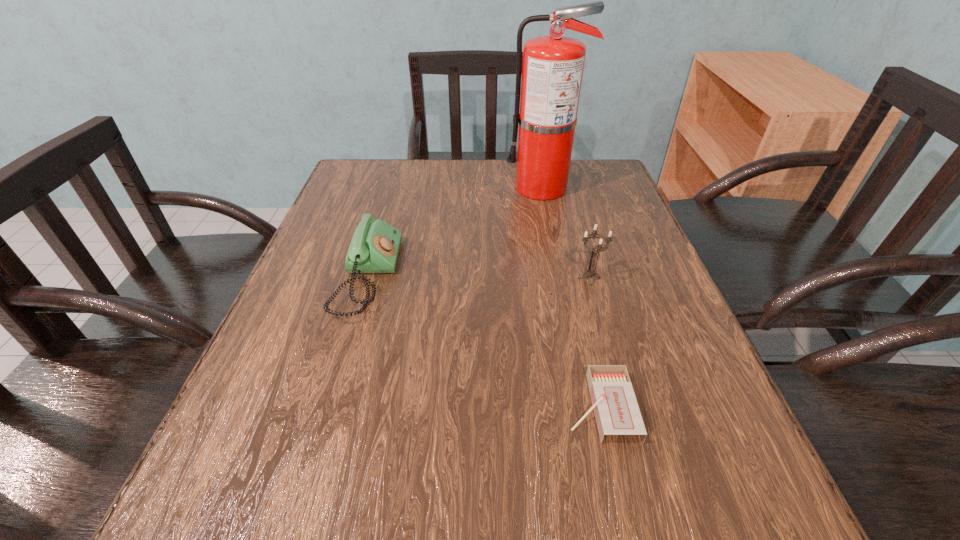
You are a GUI agent. You are given a task and a screenshot of the screen. Output one action in this format:
    pyautogui.click(x=<x>, y=<y>)
    Task: Click on the free point that satisfies the following two spatial constraints: 1. on the dial of the telephone; 2. on the left side of the second tallest object
    
    Given the screenshot: What is the action you would take?
    pyautogui.click(x=368, y=278)

What are the coordinates of `blank area in the image that satisfies the following two spatial constraints: 1. on the dial of the third shortest object; 2. on the left side of the leftmost object` in the screenshot? It's located at (368, 278).

This screenshot has height=540, width=960. In order to click on vacant space that satisfies the following two spatial constraints: 1. on the dial of the leftmost object; 2. on the left side of the third shortest object in this screenshot , I will do `click(368, 278)`.

Locate an element on the screen. free region that satisfies the following two spatial constraints: 1. at the nozzle of the candle holder; 2. on the right side of the farthest object is located at coordinates [x=562, y=278].